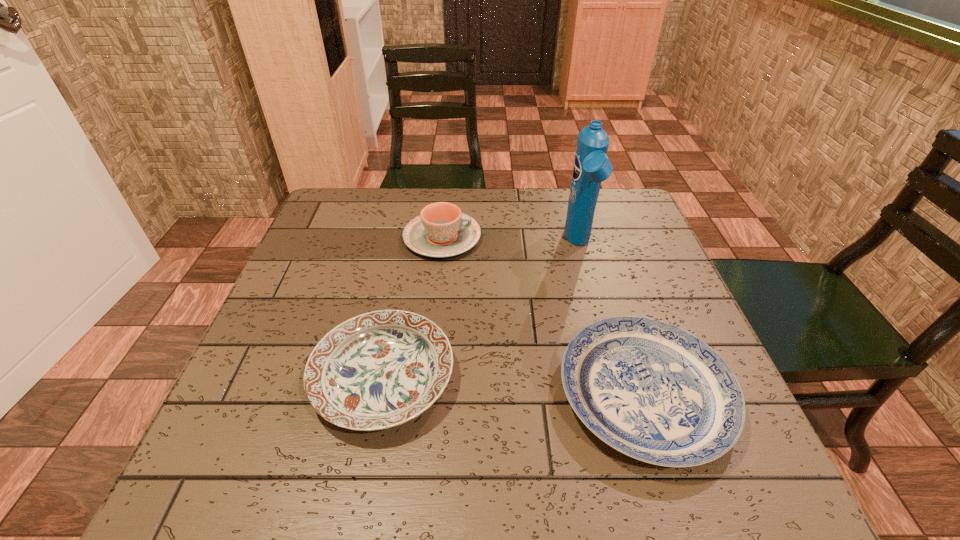
At what (x,y) coordinates should I click in order to perform the action: click on shampoo. Please return your answer as a coordinate pair (x, y). The height and width of the screenshot is (540, 960). Looking at the image, I should click on (591, 166).

At what (x,y) coordinates should I click in order to perform the action: click on the second tallest object. Please return your answer as a coordinate pair (x, y). The height and width of the screenshot is (540, 960). Looking at the image, I should click on (441, 230).

Locate an element on the screen. This screenshot has height=540, width=960. the left plate is located at coordinates (381, 369).

You are a GUI agent. You are given a task and a screenshot of the screen. Output one action in this format:
    pyautogui.click(x=<x>, y=<y>)
    Task: Click on the right plate
    
    Given the screenshot: What is the action you would take?
    pyautogui.click(x=649, y=389)

Locate an element on the screen. free space located 0.210m on the left of the shampoo is located at coordinates (484, 244).

At what (x,y) coordinates should I click in order to perform the action: click on free space located 0.220m on the handle side of the second tallest object. Please return your answer as a coordinate pair (x, y). Looking at the image, I should click on (565, 238).

You are a GUI agent. You are given a task and a screenshot of the screen. Output one action in this format:
    pyautogui.click(x=<x>, y=<y>)
    Task: Click on the free space located 0.320m on the back of the left plate
    This screenshot has height=540, width=960.
    Given the screenshot: What is the action you would take?
    pyautogui.click(x=411, y=234)

In order to click on vacant space positioned on the back of the right plate in this screenshot , I will do `click(603, 265)`.

Find the location of a particular element. Image resolution: width=960 pixels, height=540 pixels. shampoo located at the far edge is located at coordinates (591, 166).

At what (x,y) coordinates should I click in order to perform the action: click on chinaware present at the far edge. Please return your answer as a coordinate pair (x, y). This screenshot has width=960, height=540. Looking at the image, I should click on (441, 230).